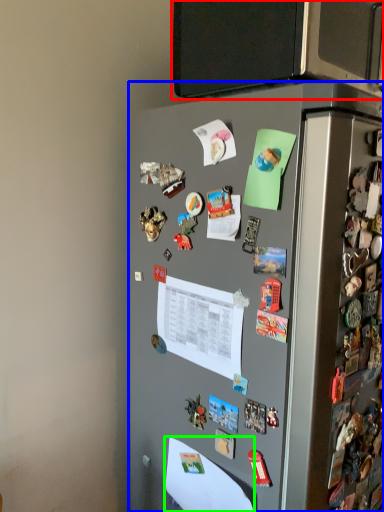
Question: Which object is the farthest from back (highlighted by a red box)? Choose among these: refrigerator (highlighted by a blue box) or paper (highlighted by a green box).

Choices:
 (A) refrigerator
 (B) paper

Answer: (B)